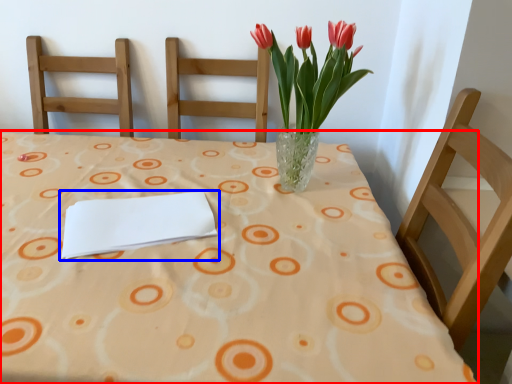
Question: Which object appears closest to the camera in this image, table (highlighted by a red box) or journal (highlighted by a blue box)?

Choices:
 (A) table
 (B) journal

Answer: (A)